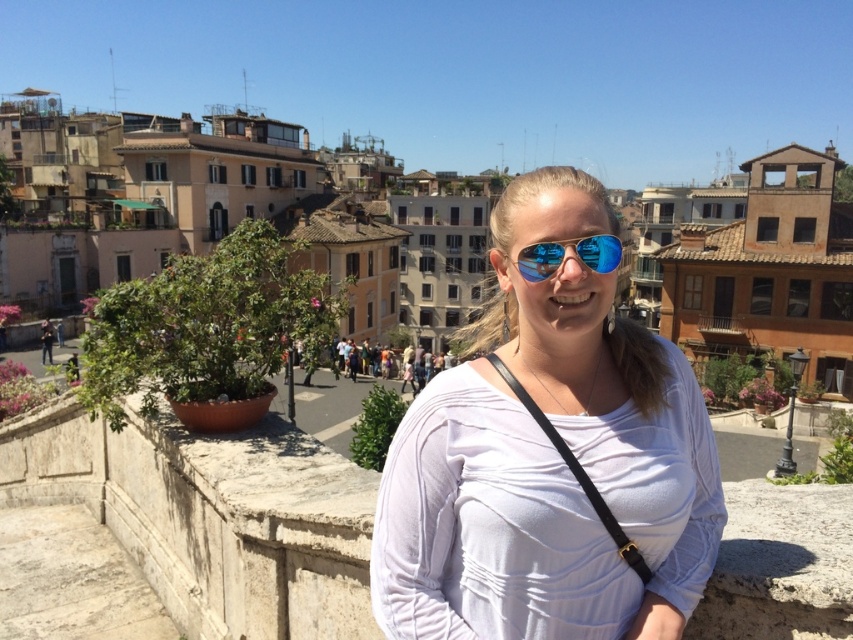
Question: Can you confirm if white matte shirt at center is positioned to the right of white stone ledge at center?

Choices:
 (A) yes
 (B) no

Answer: (A)

Question: Which object is farther from the camera taking this photo?

Choices:
 (A) white stone ledge at center
 (B) white matte shirt at center

Answer: (B)

Question: Is white matte shirt at center further to camera compared to reflective blue aviator sunglasses at center?

Choices:
 (A) no
 (B) yes

Answer: (A)

Question: Estimate the real-world distances between objects in this image. Which object is closer to the white matte shirt at center?

Choices:
 (A) reflective blue aviator sunglasses at center
 (B) white stone ledge at center

Answer: (A)

Question: In this image, where is white matte shirt at center located relative to white stone ledge at center?

Choices:
 (A) below
 (B) above

Answer: (B)

Question: Considering the real-world distances, which object is farthest from the white stone ledge at center?

Choices:
 (A) reflective blue aviator sunglasses at center
 (B) white matte shirt at center

Answer: (A)